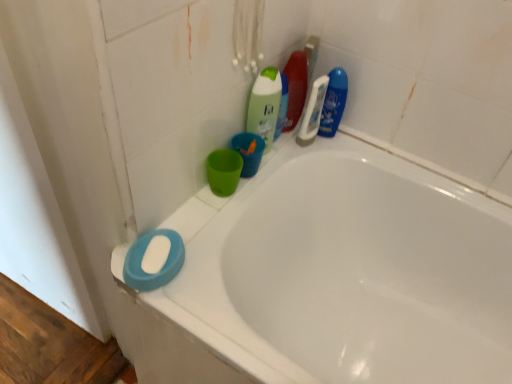
In order to click on vacant space behind white matte soap at lower left in this screenshot , I will do `click(199, 215)`.